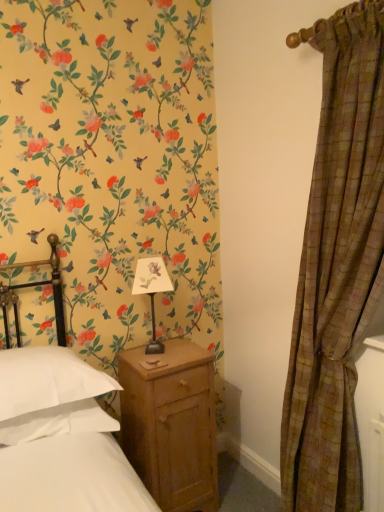
Question: From their relative heights in the image, would you say matte black table lamp at center is taller or shorter than brown plaid curtain at right?

Choices:
 (A) short
 (B) tall

Answer: (A)

Question: Is matte black table lamp at center situated inside brown plaid curtain at right or outside?

Choices:
 (A) inside
 (B) outside

Answer: (B)

Question: Based on their relative distances, which object is farther from the white soft pillow at lower left?

Choices:
 (A) matte black table lamp at center
 (B) wooden nightstand at lower center
 (C) brown plaid curtain at right

Answer: (C)

Question: Which object is positioned closest to the wooden nightstand at lower center?

Choices:
 (A) white soft pillow at lower left
 (B) matte black table lamp at center
 (C) brown plaid curtain at right

Answer: (B)